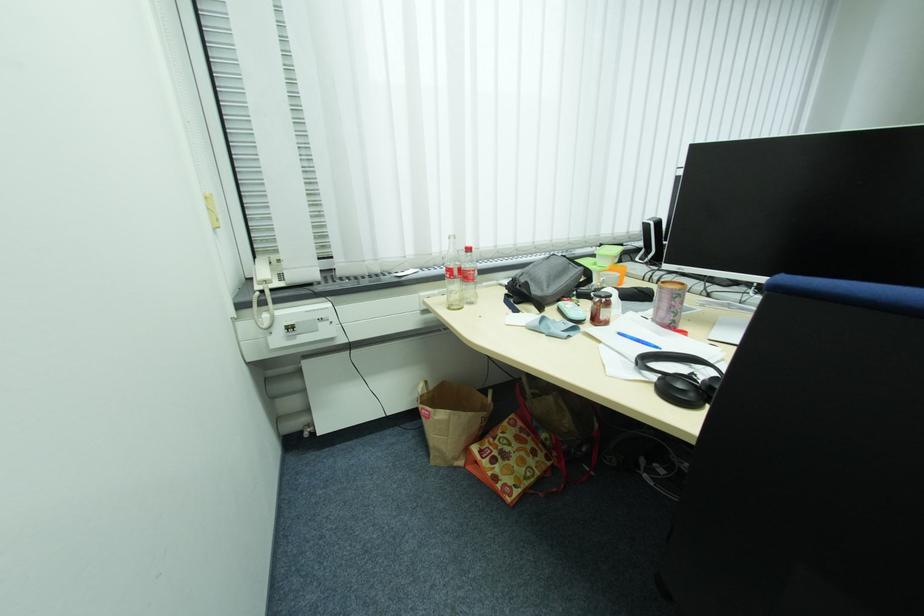
The location [679,376] corresponds to which object?

This point indicates the black headphones.